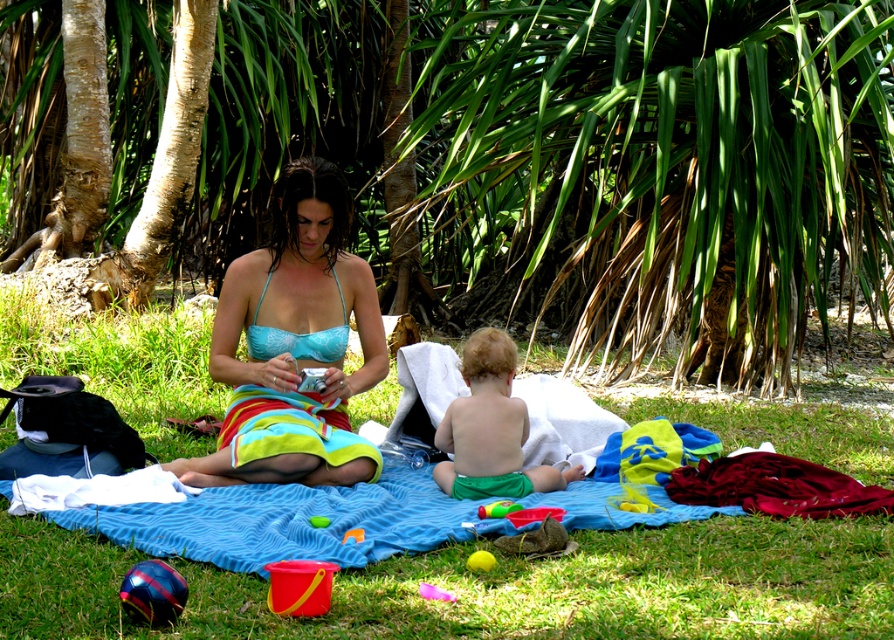
Question: Does green leafy palm tree at center have a greater width compared to rubber pink ball at lower center?

Choices:
 (A) no
 (B) yes

Answer: (B)

Question: Estimate the real-world distances between objects in this image. Which object is farther from the green cotton shorts at center?

Choices:
 (A) green leafy palm tree at center
 (B) yellow rubber ball at lower center
 (C) matte blue bikini top at center
 (D) green grass at center

Answer: (A)

Question: Where is matte blue bikini top at center located in relation to yellow rubber ball at lower center in the image?

Choices:
 (A) right
 (B) left

Answer: (B)

Question: Can you confirm if green grass at center is positioned to the left of yellow rubber ball at lower center?

Choices:
 (A) no
 (B) yes

Answer: (B)

Question: Which object is closer to the camera taking this photo?

Choices:
 (A) green cotton shorts at center
 (B) rubber pink ball at lower center
 (C) green grass at center
 (D) rubber yellow bucket at lower center

Answer: (C)

Question: Which object appears closest to the camera in this image?

Choices:
 (A) rubber yellow bucket at lower center
 (B) green grass at center
 (C) rubber pink ball at lower center
 (D) green leafy palm tree at center

Answer: (B)